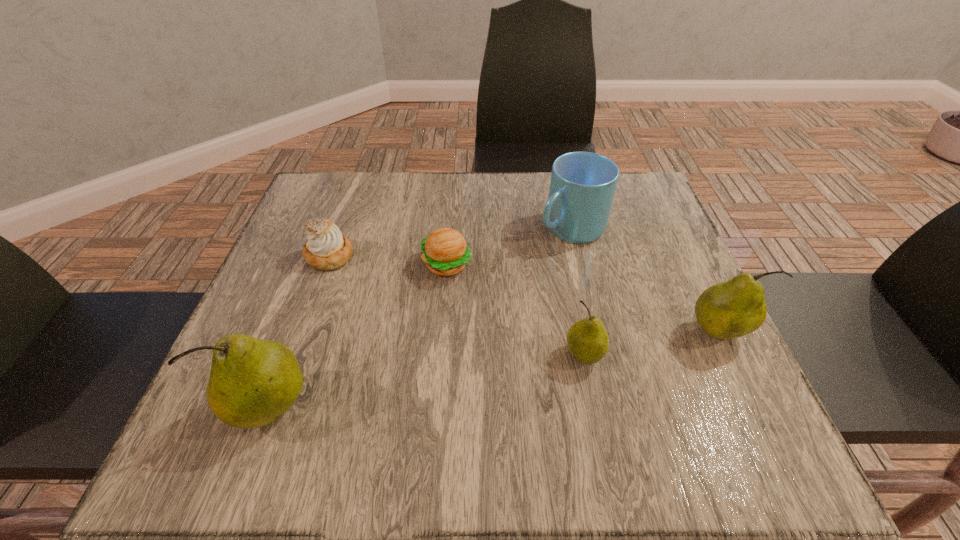
Image resolution: width=960 pixels, height=540 pixels. I want to click on vacant space situated 0.350m on the back of the rightmost pear, so (659, 207).

Identify the location of vacant space located on the right of the third object from left to right. (509, 265).

This screenshot has width=960, height=540. I want to click on free space located 0.190m on the left of the mug, so click(x=457, y=228).

Identify the location of free space located on the right of the pastry. The image size is (960, 540). (412, 256).

Locate an element on the screen. The width and height of the screenshot is (960, 540). object that is positioned at the far edge is located at coordinates (582, 187).

You are a GUI agent. You are given a task and a screenshot of the screen. Output one action in this format:
    pyautogui.click(x=<x>, y=<y>)
    Task: Click on the pear present at the left edge
    This screenshot has width=960, height=540.
    Given the screenshot: What is the action you would take?
    pyautogui.click(x=252, y=382)

I want to click on pastry that is at the left edge, so click(x=326, y=248).

Locate an element on the screen. The image size is (960, 540). pear at the right edge is located at coordinates (732, 309).

You are a GUI agent. You are given a task and a screenshot of the screen. Output one action in this format:
    pyautogui.click(x=<x>, y=<y>)
    Task: Click on the mug present at the right edge
    
    Given the screenshot: What is the action you would take?
    pyautogui.click(x=582, y=187)

Where is `object that is positioned at the near left corner`? object that is positioned at the near left corner is located at coordinates (252, 382).